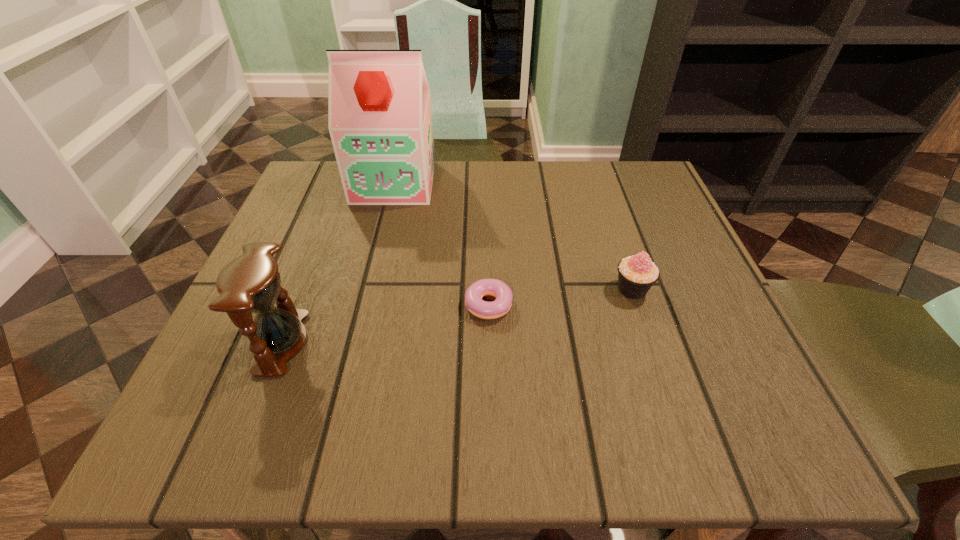
I want to click on vacant space at the far left corner of the desktop, so click(x=305, y=207).

Where is `vacant space at the near left corner`? This screenshot has height=540, width=960. vacant space at the near left corner is located at coordinates (195, 421).

Where is `vacant area at the far right corner of the desktop`? This screenshot has height=540, width=960. vacant area at the far right corner of the desktop is located at coordinates (659, 187).

Where is `vacant area that lies between the third tallest object and the second tallest object`? vacant area that lies between the third tallest object and the second tallest object is located at coordinates (457, 316).

Identify the location of free space between the hourglass and the farthest object. (338, 262).

The image size is (960, 540). In order to click on vacant point located between the rightmost object and the hourglass in this screenshot , I will do `click(457, 316)`.

At what (x,y) coordinates should I click in order to perform the action: click on unoccupied position between the second tallest object and the farthest object. Please return your answer as a coordinate pair (x, y). The width and height of the screenshot is (960, 540). Looking at the image, I should click on tap(338, 262).

Identify the location of vacant area that lies between the hourglass and the soya milk. The height and width of the screenshot is (540, 960). (338, 262).

In order to click on empty location between the cupcake and the doughnut in this screenshot , I will do `click(557, 297)`.

Find the location of a particular element. The width and height of the screenshot is (960, 540). vacant area between the second tallest object and the cupcake is located at coordinates (457, 316).